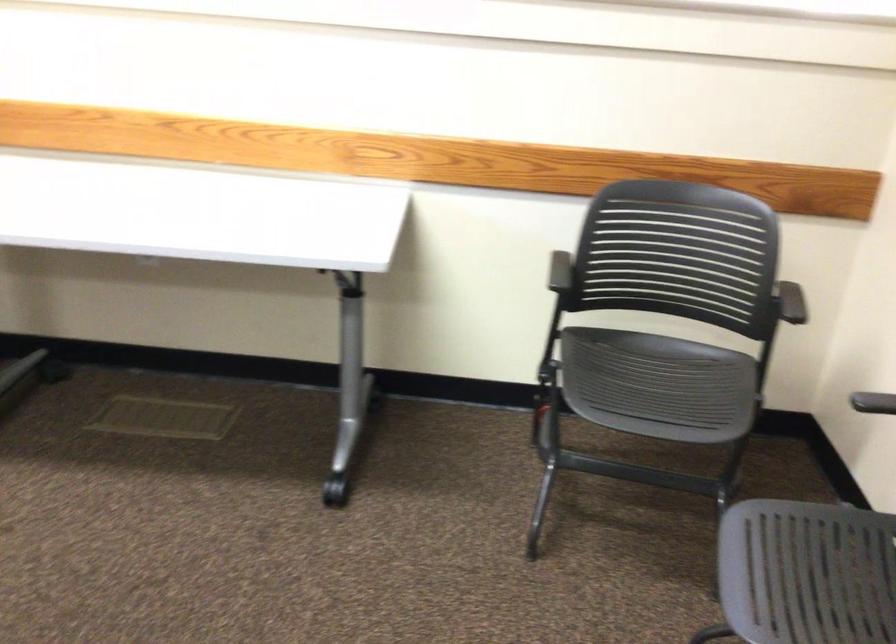
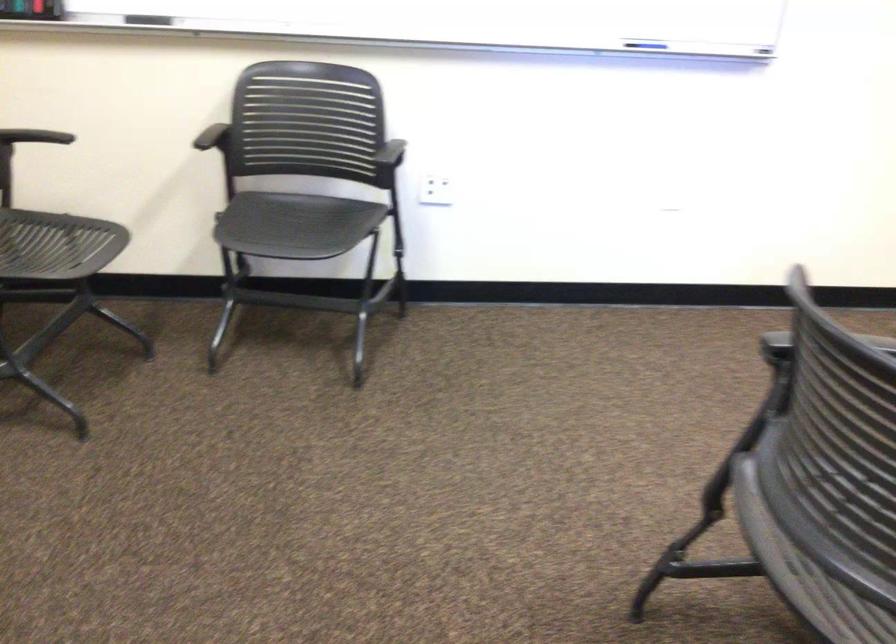
The point at [742,294] is marked in the first image. Where is the corresponding point in the second image?

(35, 136)